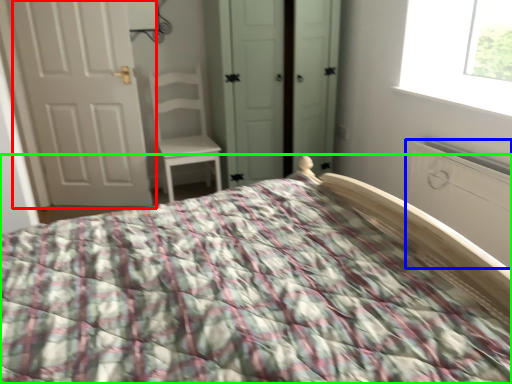
Question: Which is farther away from door (highlighted by a red box)? armoire (highlighted by a blue box) or bed (highlighted by a green box)?

Choices:
 (A) armoire
 (B) bed

Answer: (A)